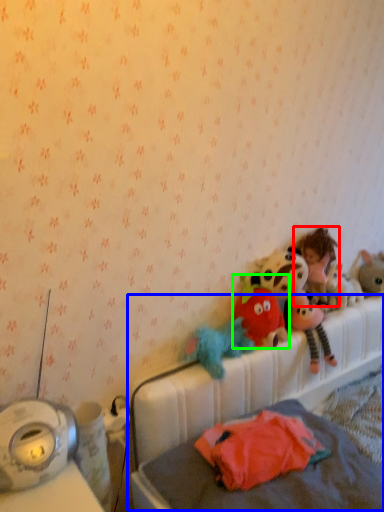
Question: Which object is positioned closest to person (highlighted by a red box)? Select from hospital bed (highlighted by a blue box) and toy (highlighted by a green box).

Choices:
 (A) hospital bed
 (B) toy

Answer: (B)